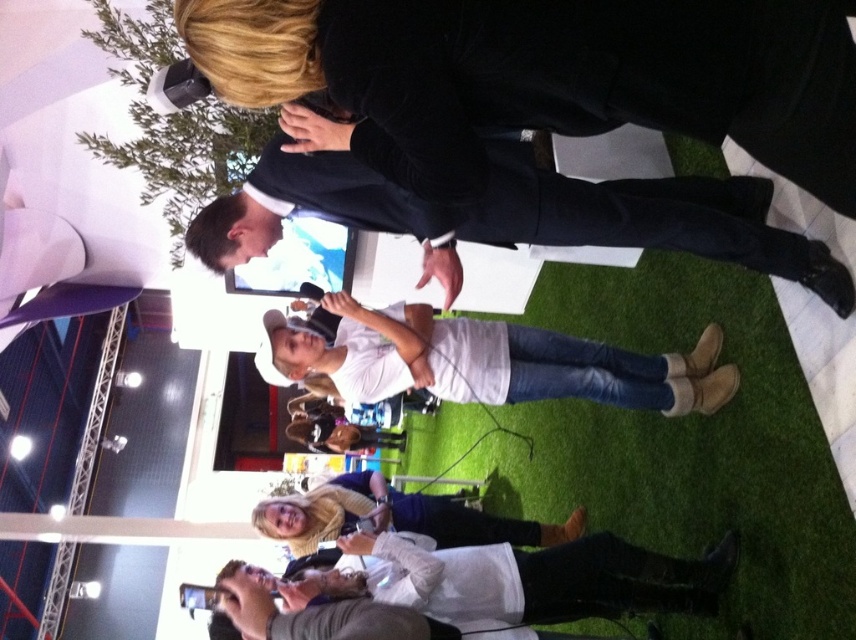
Question: Can you confirm if black velvet suit at upper center is positioned above matte white phone at center?

Choices:
 (A) yes
 (B) no

Answer: (A)

Question: Which is farther from the black suit at upper center?

Choices:
 (A) white matte shirt at center
 (B) black velvet suit at upper center

Answer: (A)

Question: Is black suit at upper center wider than matte white phone at center?

Choices:
 (A) yes
 (B) no

Answer: (A)

Question: Which of these objects is positioned closest to the black suit at upper center?

Choices:
 (A) black velvet suit at upper center
 (B) white matte shirt at center

Answer: (A)

Question: Which point is closer to the camera?

Choices:
 (A) (366, 209)
 (B) (821, 97)
 (C) (467, 371)

Answer: (B)

Question: Does black velvet suit at upper center have a smaller size compared to matte white phone at center?

Choices:
 (A) yes
 (B) no

Answer: (A)